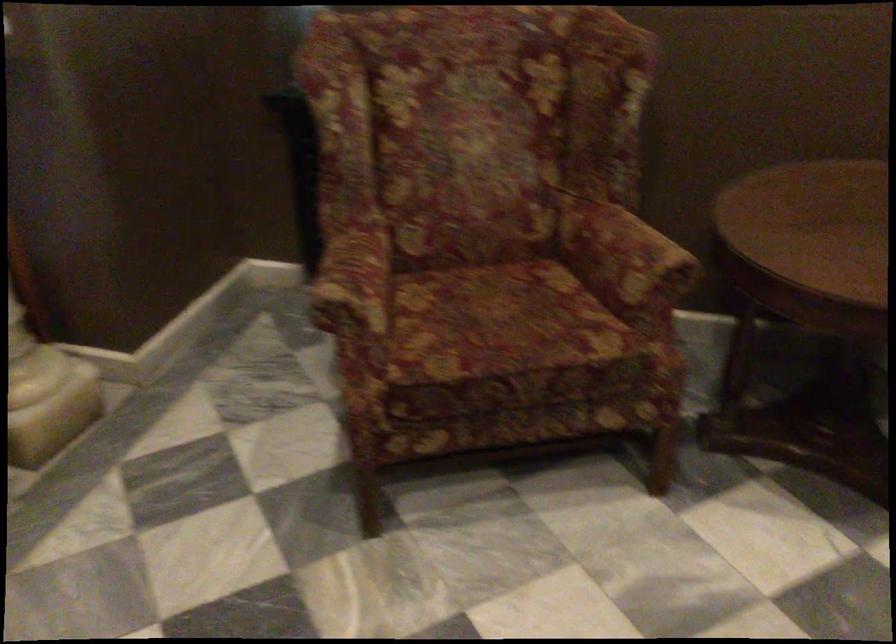
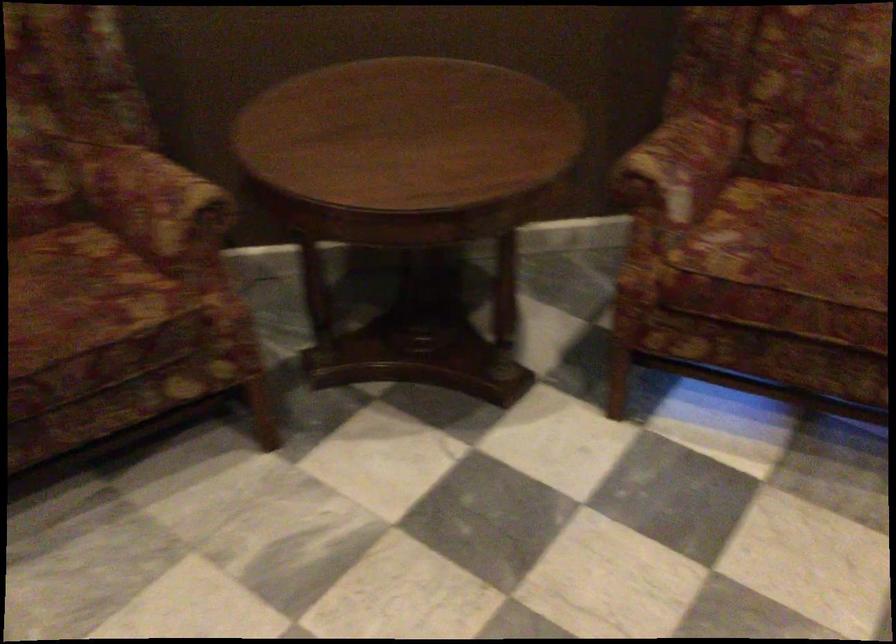
Question: The camera is either moving clockwise (left) or counter-clockwise (right) around the object. The first image is from the beginning of the video and the second image is from the end. Is the camera moving left or right when shooting the video?

Choices:
 (A) Left
 (B) Right

Answer: (A)